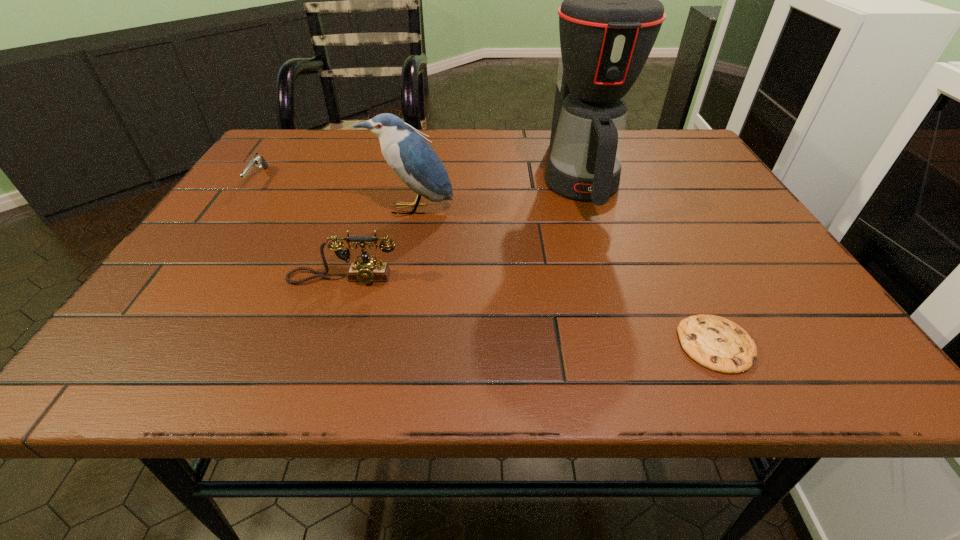
At what (x,y) coordinates should I click in order to perform the action: click on vacant space located 0.150m on the front-facing side of the third shortest object. Please return your answer as a coordinate pair (x, y). This screenshot has height=540, width=960. Looking at the image, I should click on (319, 353).

I want to click on vacant region located 0.190m on the front-facing side of the second shortest object, so click(213, 244).

The width and height of the screenshot is (960, 540). I want to click on vacant space located 0.260m on the back of the shortest object, so click(659, 227).

The image size is (960, 540). I want to click on coffee maker present at the far edge, so click(610, 17).

Identify the location of pistol that is at the far edge. (257, 161).

This screenshot has width=960, height=540. What are the coordinates of `object that is at the near edge` in the screenshot? It's located at (719, 344).

Find the location of a particular element. Image resolution: width=960 pixels, height=540 pixels. object at the left edge is located at coordinates (257, 161).

Image resolution: width=960 pixels, height=540 pixels. In order to click on object that is at the right edge in this screenshot , I will do `click(719, 344)`.

At what (x,y) coordinates should I click in order to perform the action: click on object at the far left corner. Please return your answer as a coordinate pair (x, y). Looking at the image, I should click on (257, 161).

Locate an element on the screen. object at the near right corner is located at coordinates (719, 344).